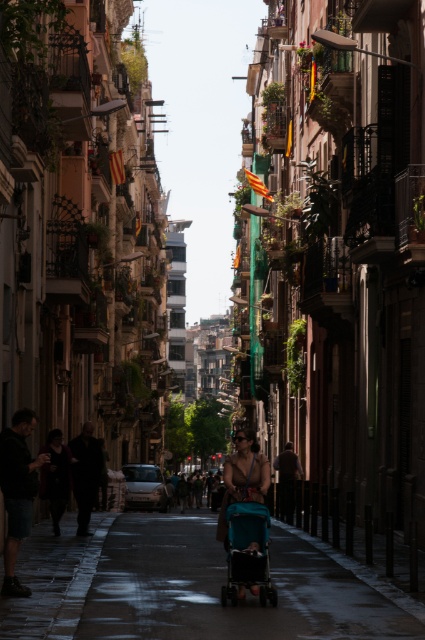
You are a parent pushing a teal plastic stroller at center and a teal fabric stroller at center down the narrow street. Since the street is narrow, you need to walk side by side. Which stroller should you place on the left to match their positions?

You should place the teal plastic stroller at center on the left side because it is positioned on the left side of the teal fabric stroller at center.

You are a parent pushing a teal plastic stroller at center and a teal fabric stroller at center down this narrow street. Which stroller will require more space between the buildings to navigate safely?

The teal plastic stroller at center has a larger size compared to the teal fabric stroller at center, so it will require more space between the buildings to navigate safely.